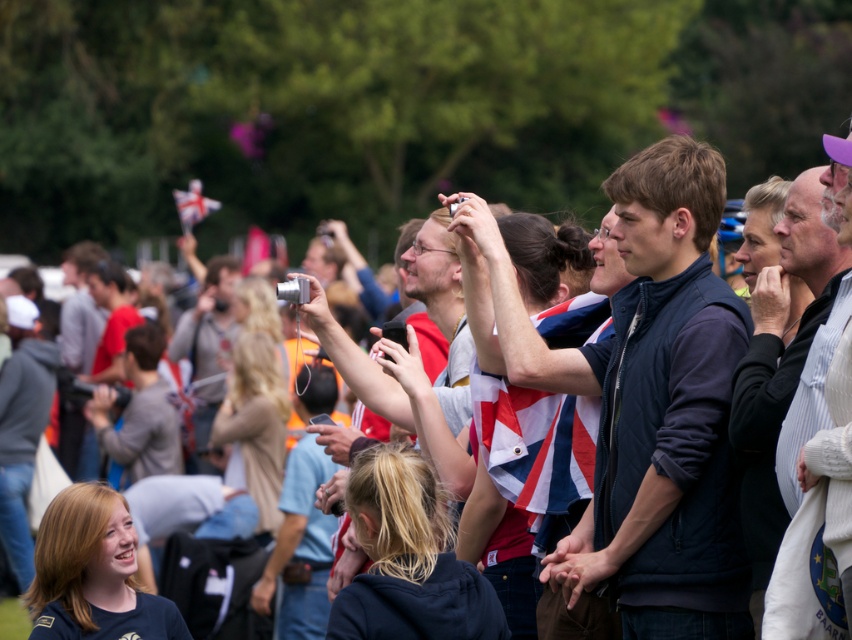
Question: Is white fabric flag at upper center below red fabric flag at center?

Choices:
 (A) yes
 (B) no

Answer: (B)

Question: Does white fabric flag at upper center have a smaller size compared to red fabric flag at center?

Choices:
 (A) no
 (B) yes

Answer: (A)

Question: Does white fabric flag at upper center have a larger size compared to red fabric flag at center?

Choices:
 (A) no
 (B) yes

Answer: (B)